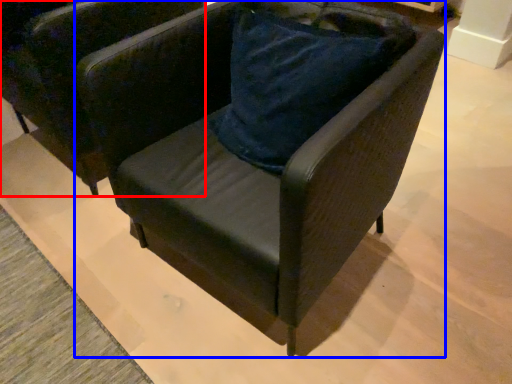
Question: Which object is further to the camera taking this photo, chair (highlighted by a red box) or chair (highlighted by a blue box)?

Choices:
 (A) chair
 (B) chair

Answer: (A)